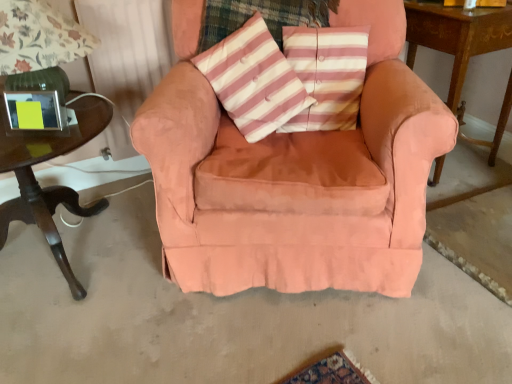
The image size is (512, 384). Find the location of `pink striped cushion at center`. pink striped cushion at center is located at coordinates (327, 75).

Image resolution: width=512 pixels, height=384 pixels. What are the coordinates of `dark wood table at left, positioned as the first table in left-to-right order` in the screenshot? It's located at (51, 186).

What do you see at coordinates (295, 176) in the screenshot? The image size is (512, 384). I see `suede-like peach armchair at center` at bounding box center [295, 176].

Measure the distance between point (x=440, y=161) and camera.

Point (x=440, y=161) is 6.54 feet from camera.

Locate an element on the screen. This screenshot has height=384, width=512. green glass table lamp at left is located at coordinates (39, 37).

From the image's perspective, is dark wood table at left, positioned as the second table in right-to-left order, located beneath wooden table at right, the second table when ordered from left to right?

Yes.

From a real-world perspective, does dark wood table at left, positioned as the first table in left-to-right order, stand above wooden table at right, the second table when ordered from left to right?

No, from a real-world perspective, dark wood table at left, positioned as the first table in left-to-right order, is not over wooden table at right, the second table when ordered from left to right

Could wooden table at right, arranged as the 1th table when viewed from the right, be considered to be inside dark wood table at left, positioned as the first table in left-to-right order?

No.

Which is more to the left, dark wood table at left, positioned as the second table in right-to-left order, or wooden table at right, arranged as the 1th table when viewed from the right?

dark wood table at left, positioned as the second table in right-to-left order.

In the scene shown: Is dark wood table at left, positioned as the second table in right-to-left order, looking in the opposite direction of pink striped fabric pillow at center?

No.

Would you say dark wood table at left, positioned as the second table in right-to-left order, is inside or outside pink striped fabric pillow at center?

Result: The correct answer is: outside.

Does dark wood table at left, positioned as the second table in right-to-left order, have a greater height compared to pink striped fabric pillow at center?

Yes, dark wood table at left, positioned as the second table in right-to-left order, is taller than pink striped fabric pillow at center.

Is dark wood table at left, positioned as the second table in right-to-left order, at the left side of pink striped fabric pillow at center?

Correct, you'll find dark wood table at left, positioned as the second table in right-to-left order, to the left of pink striped fabric pillow at center.

Considering the relative sizes of dark wood table at left, positioned as the second table in right-to-left order, and pink striped cushion at center in the image provided, is dark wood table at left, positioned as the second table in right-to-left order, taller than pink striped cushion at center?

Yes, dark wood table at left, positioned as the second table in right-to-left order, is taller than pink striped cushion at center.

In the image, is dark wood table at left, positioned as the second table in right-to-left order, positioned in front of or behind pink striped cushion at center?

Clearly, dark wood table at left, positioned as the second table in right-to-left order, is in front of pink striped cushion at center.

In the scene shown: Looking at their sizes, would you say dark wood table at left, positioned as the first table in left-to-right order, is wider or thinner than pink striped cushion at center?

In the image, dark wood table at left, positioned as the first table in left-to-right order, appears to be wider than pink striped cushion at center.

Is dark wood table at left, positioned as the second table in right-to-left order, taller or shorter than suede-like peach armchair at center?

In the image, dark wood table at left, positioned as the second table in right-to-left order, appears to be shorter than suede-like peach armchair at center.

Can you tell me how much dark wood table at left, positioned as the second table in right-to-left order, and suede-like peach armchair at center differ in facing direction?

30.3 degrees separate the facing orientations of dark wood table at left, positioned as the second table in right-to-left order, and suede-like peach armchair at center.

Relative to suede-like peach armchair at center, is dark wood table at left, positioned as the second table in right-to-left order, in front or behind?

dark wood table at left, positioned as the second table in right-to-left order, is behind suede-like peach armchair at center.

Find the location of a particular element. Image resolution: width=512 pixels, height=384 pixels. chair located on the right of dark wood table at left, positioned as the second table in right-to-left order is located at coordinates (295, 176).

Could you tell me if pink striped cushion at center is turned towards dark wood table at left, positioned as the second table in right-to-left order?

No, pink striped cushion at center is not turned towards dark wood table at left, positioned as the second table in right-to-left order.

In the scene shown: From the image's perspective, is pink striped cushion at center beneath dark wood table at left, positioned as the first table in left-to-right order?

No, from the image's perspective, pink striped cushion at center is not beneath dark wood table at left, positioned as the first table in left-to-right order.

Locate an element on the screen. This screenshot has width=512, height=384. table lying below the pink striped cushion at center (from the image's perspective) is located at coordinates (51, 186).

From a real-world perspective, is green glass table lamp at left below suede-like peach armchair at center?

Incorrect, from a real-world perspective, green glass table lamp at left is higher than suede-like peach armchair at center.

Looking at the image, does green glass table lamp at left seem bigger or smaller compared to suede-like peach armchair at center?

Considering their sizes, green glass table lamp at left takes up less space than suede-like peach armchair at center.

Can you confirm if green glass table lamp at left is positioned to the left of suede-like peach armchair at center?

Yes, green glass table lamp at left is to the left of suede-like peach armchair at center.

In the scene shown: Can we say pink striped fabric pillow at center lies outside green glass table lamp at left?

Yes.

Does pink striped fabric pillow at center appear on the left side of green glass table lamp at left?

In fact, pink striped fabric pillow at center is to the right of green glass table lamp at left.

From the image's perspective, is pink striped fabric pillow at center located beneath green glass table lamp at left?

Indeed, from the image's perspective, pink striped fabric pillow at center is shown beneath green glass table lamp at left.

Between pink striped fabric pillow at center and green glass table lamp at left, which one has more height?

pink striped fabric pillow at center.

Where is `table that is on the right side of dark wood table at left, positioned as the second table in right-to-left order`? table that is on the right side of dark wood table at left, positioned as the second table in right-to-left order is located at coordinates [x=457, y=38].

Locate an element on the screen. Image resolution: width=512 pixels, height=384 pixels. throw pillow behind the dark wood table at left, positioned as the first table in left-to-right order is located at coordinates (253, 80).

From the image, which object appears to be nearer to dark wood table at left, positioned as the second table in right-to-left order, pink striped cushion at center or green glass table lamp at left?

green glass table lamp at left is positioned closer to the anchor dark wood table at left, positioned as the second table in right-to-left order.

Looking at the image, which one is located further to pink striped fabric pillow at center, suede-like peach armchair at center or wooden table at right, arranged as the 1th table when viewed from the right?

The object further to pink striped fabric pillow at center is wooden table at right, arranged as the 1th table when viewed from the right.

Considering their positions, is green glass table lamp at left positioned further to wooden table at right, arranged as the 1th table when viewed from the right, than pink striped fabric pillow at center?

The object further to wooden table at right, arranged as the 1th table when viewed from the right, is green glass table lamp at left.

Looking at this image, looking at the image, which one is located closer to pink striped cushion at center, pink striped fabric pillow at center or dark wood table at left, positioned as the second table in right-to-left order?

Among the two, pink striped fabric pillow at center is located nearer to pink striped cushion at center.

When comparing their distances from green glass table lamp at left, does suede-like peach armchair at center or dark wood table at left, positioned as the second table in right-to-left order, seem closer?

Among the two, dark wood table at left, positioned as the second table in right-to-left order, is located nearer to green glass table lamp at left.

Looking at this image, from the image, which object appears to be farther from green glass table lamp at left, pink striped cushion at center or pink striped fabric pillow at center?

Among the two, pink striped cushion at center is located further to green glass table lamp at left.

Considering their positions, is suede-like peach armchair at center positioned closer to dark wood table at left, positioned as the second table in right-to-left order, than pink striped fabric pillow at center?

pink striped fabric pillow at center lies closer to dark wood table at left, positioned as the second table in right-to-left order, than the other object.

From the image, which object appears to be farther from pink striped cushion at center, green glass table lamp at left or wooden table at right, arranged as the 1th table when viewed from the right?

Based on the image, green glass table lamp at left appears to be further to pink striped cushion at center.

Identify the location of pillow between suede-like peach armchair at center and wooden table at right, the second table when ordered from left to right, from left to right. The height and width of the screenshot is (384, 512). (327, 75).

Image resolution: width=512 pixels, height=384 pixels. Identify the location of chair between green glass table lamp at left and pink striped cushion at center in the horizontal direction. (295, 176).

The width and height of the screenshot is (512, 384). I want to click on throw pillow between suede-like peach armchair at center and pink striped cushion at center along the z-axis, so click(x=253, y=80).

In order to click on throw pillow located between green glass table lamp at left and pink striped cushion at center in the left-right direction in this screenshot , I will do `click(253, 80)`.